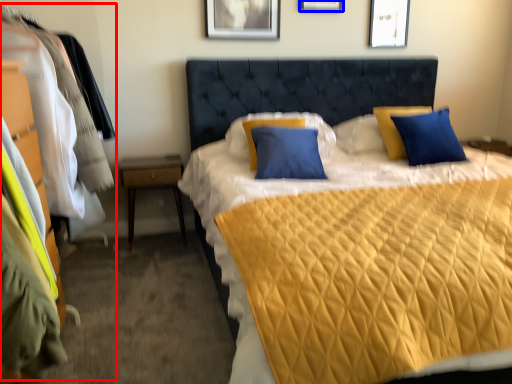
Question: Which object appears farthest to the camera in this image, dresser (highlighted by a red box) or picture frame (highlighted by a blue box)?

Choices:
 (A) dresser
 (B) picture frame

Answer: (B)